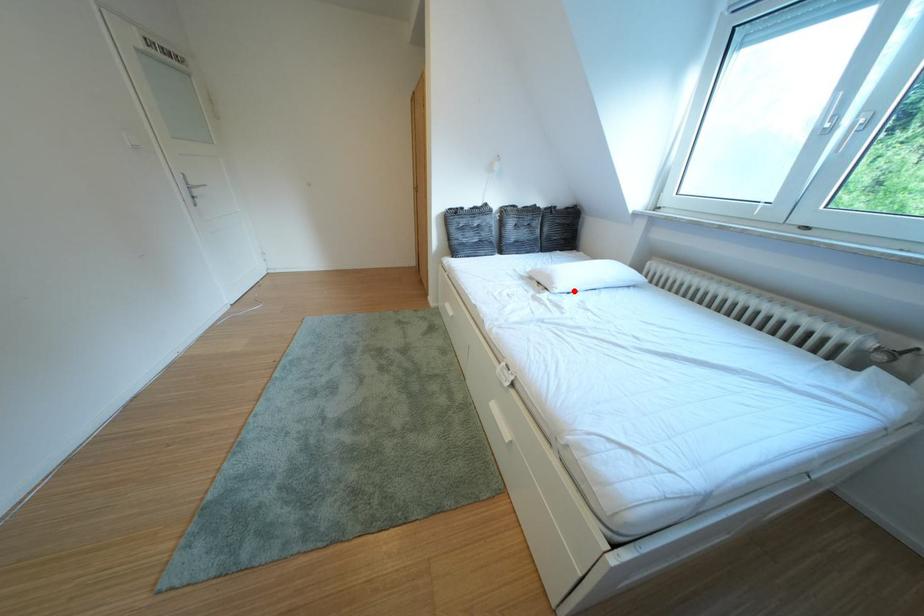
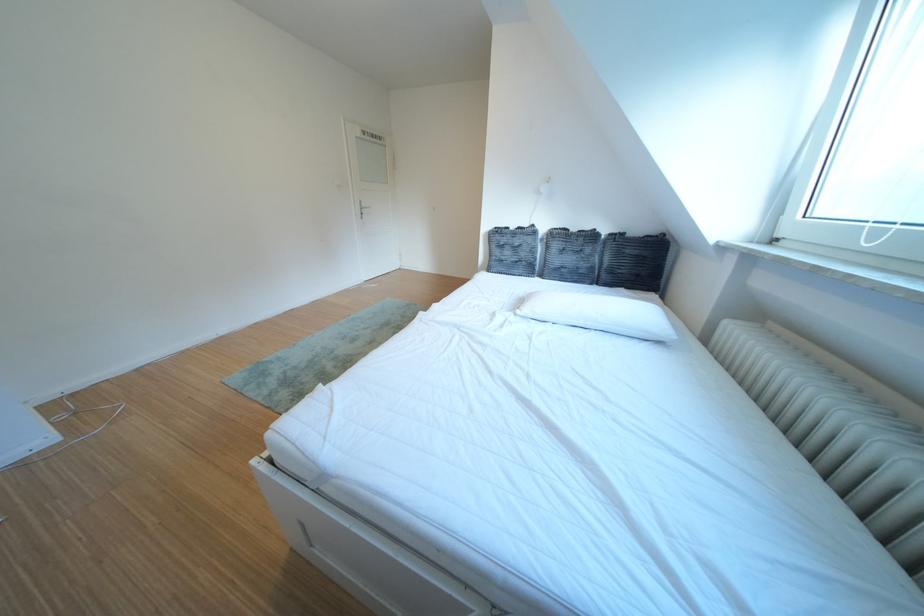
In the second image, find the point that corresponds to the highlighted location in the first image.

(540, 314)